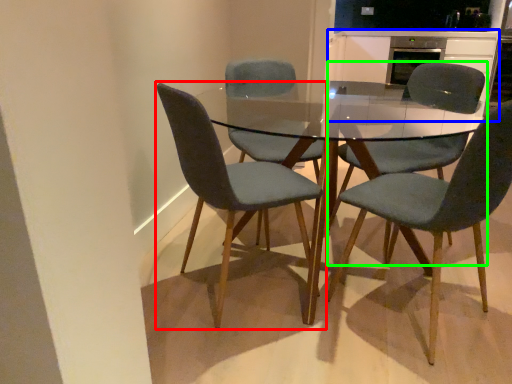
Question: Which object is positioned farthest from chair (highlighted by a red box)? Select from cabinetry (highlighted by a blue box) and chair (highlighted by a green box).

Choices:
 (A) cabinetry
 (B) chair

Answer: (A)